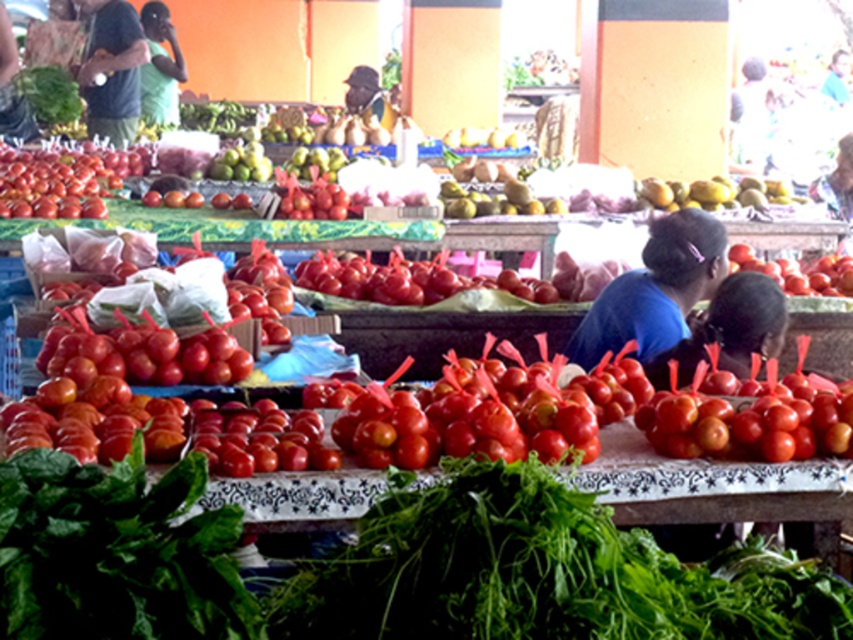
In the scene shown: You are setting up a display at a market stall and have two items to arrange. You have the green leafy at lower left and the blue fabric at center. If you want to maximize the use of space, which item should you place in the area where space is limited?

The green leafy at lower left occupies less space than blue fabric at center, so it should be placed in the limited space area to maximize space usage.